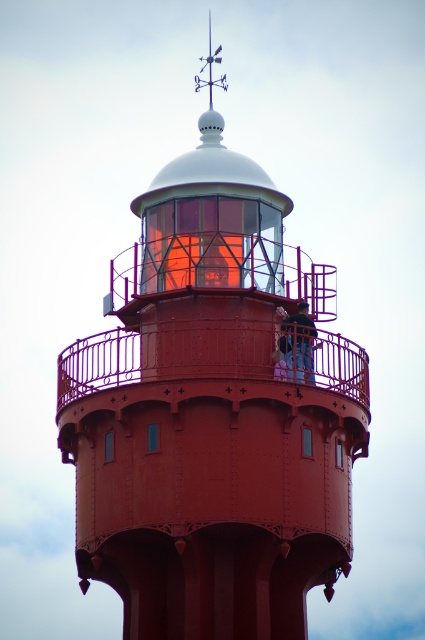
Does smooth red lighthouse at center appear under blue denim jeans at center?

Incorrect, smooth red lighthouse at center is not positioned below blue denim jeans at center.

Is smooth red lighthouse at center smaller than blue denim jeans at center?

No.

What do you see at coordinates (212, 413) in the screenshot?
I see `smooth red lighthouse at center` at bounding box center [212, 413].

You are a GUI agent. You are given a task and a screenshot of the screen. Output one action in this format:
    pyautogui.click(x=<x>, y=<y>)
    Task: Click on the smooth red lighthouse at center
    This screenshot has height=640, width=425.
    Given the screenshot: What is the action you would take?
    pyautogui.click(x=212, y=413)